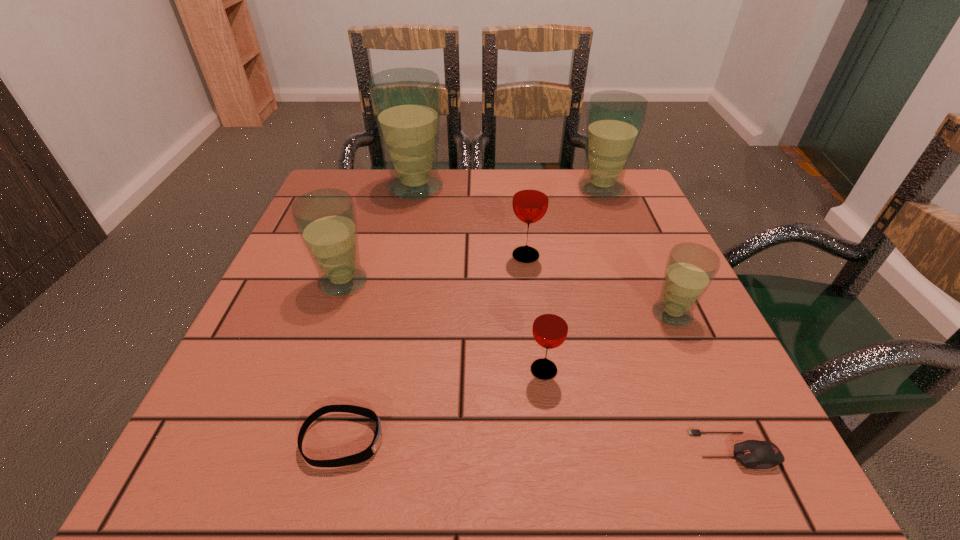
Where is `mouse present at the near edge`? Image resolution: width=960 pixels, height=540 pixels. mouse present at the near edge is located at coordinates click(753, 454).

The height and width of the screenshot is (540, 960). Find the location of `wristband that is at the left edge`. wristband that is at the left edge is located at coordinates (363, 456).

This screenshot has height=540, width=960. Find the location of `mouse that is at the right edge`. mouse that is at the right edge is located at coordinates (753, 454).

This screenshot has width=960, height=540. I want to click on object that is at the far left corner, so tap(406, 102).

This screenshot has height=540, width=960. Identify the location of object that is positioned at the near left corner. (363, 456).

Find the location of a particular element. object that is at the far right corner is located at coordinates (615, 118).

Locate an element on the screen. object that is at the near right corner is located at coordinates (753, 454).

Find the location of a particular element. The width and height of the screenshot is (960, 540). vacant space at the far edge of the desktop is located at coordinates (490, 193).

This screenshot has height=540, width=960. Identify the location of free space at the near edge of the desktop. (338, 472).

Locate an element on the screen. This screenshot has height=540, width=960. vacant space at the left edge of the desktop is located at coordinates (277, 281).